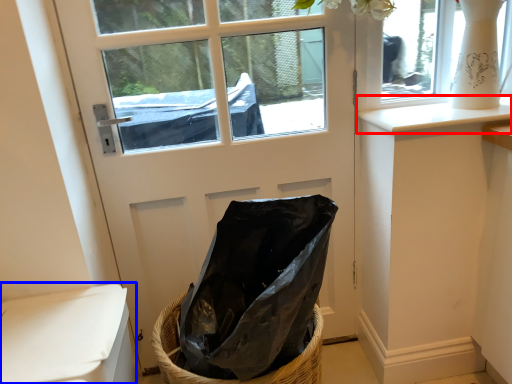
Question: Which of the following is the farthest to the observer, window sill (highlighted by a red box) or armchair (highlighted by a blue box)?

Choices:
 (A) window sill
 (B) armchair

Answer: (A)